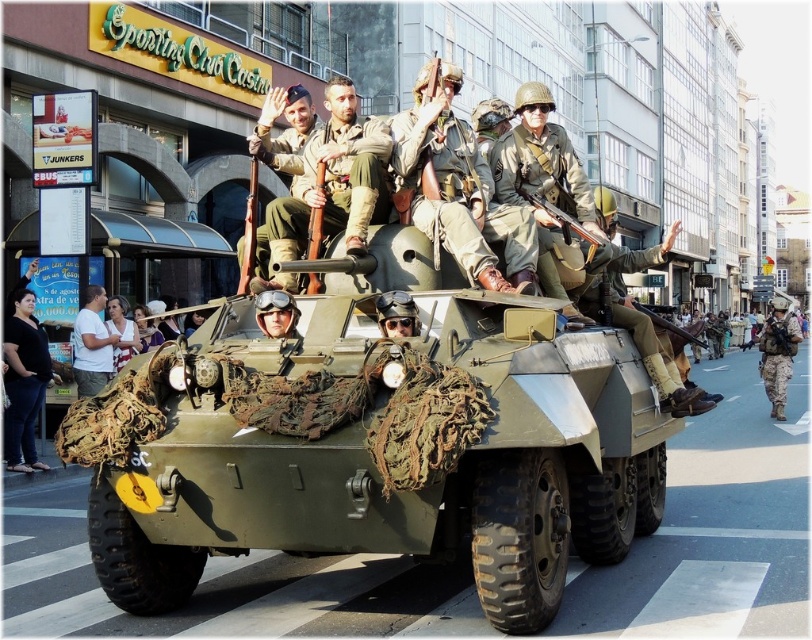
Between point (761, 376) and point (700, 340), which one is positioned behind?

The point (761, 376) is behind.

Does camouflage fabric uniform at right have a greater height compared to matte brown rifle at center?

Yes.

Where is `camouflage fabric uniform at right`? camouflage fabric uniform at right is located at coordinates (776, 353).

Locate an element on the screen. This screenshot has width=812, height=640. camouflage fabric uniform at right is located at coordinates (776, 353).

Between camouflage fabric helmet at upper center and white t-shirt at lower left, which one has less height?

With less height is white t-shirt at lower left.

Does camouflage fabric helmet at upper center appear on the left side of white t-shirt at lower left?

Incorrect, camouflage fabric helmet at upper center is not on the left side of white t-shirt at lower left.

Looking at this image, who is more distant from viewer, (679, 396) or (72, 358)?

Positioned behind is point (72, 358).

You are a GUI agent. You are given a task and a screenshot of the screen. Output one action in this format:
    pyautogui.click(x=<x>, y=<y>)
    Task: Click on the camouflage fabric helmet at upper center
    This screenshot has width=812, height=640.
    Given the screenshot: What is the action you would take?
    pyautogui.click(x=651, y=330)

Between camouflage fabric tank at center and white t-shirt at lower left, which one has less height?

With less height is camouflage fabric tank at center.

Can you confirm if camouflage fabric tank at center is thinner than white t-shirt at lower left?

In fact, camouflage fabric tank at center might be wider than white t-shirt at lower left.

What do you see at coordinates (374, 438) in the screenshot? I see `camouflage fabric tank at center` at bounding box center [374, 438].

This screenshot has width=812, height=640. What are the coordinates of `camouflage fabric tank at center` in the screenshot? It's located at (374, 438).